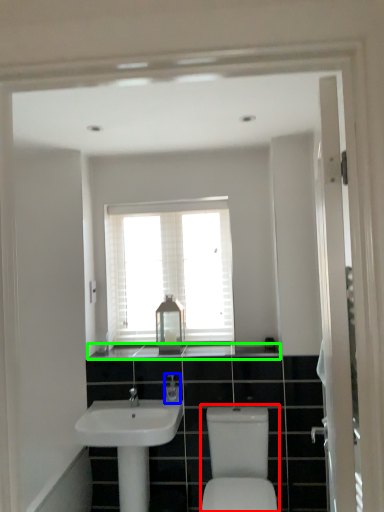
Question: Considering the real-world distances, which object is closest to sink (highlighted by a red box)? toiletry (highlighted by a blue box) or counter top (highlighted by a green box).

Choices:
 (A) toiletry
 (B) counter top

Answer: (A)